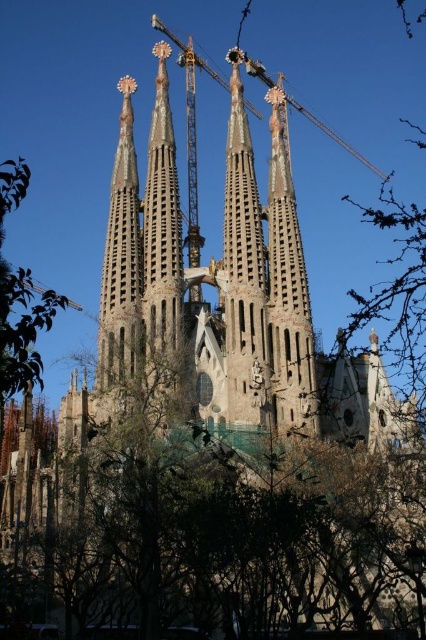
You are standing in front of the Sagrada Familia and want to take a photo of the point at coordinates point (244, 272). Which part of the Sagrada Familia should you focus your camera on?

The point at coordinates point (244, 272) is on the rustic stone tower at center, so you should focus your camera on the rustic stone tower at center to capture that point.

You are a tourist standing in front of the Sagrada Familia. You notice the rustic stone tower at center and the metallic gray crane at upper center. Which object is located more to the left side?

The rustic stone tower at center is positioned on the left side of the metallic gray crane at upper center, so it is more to the left.

What are the coordinates of the rustic stone tower at center?

The rustic stone tower at center is located at coordinates point (244, 272).